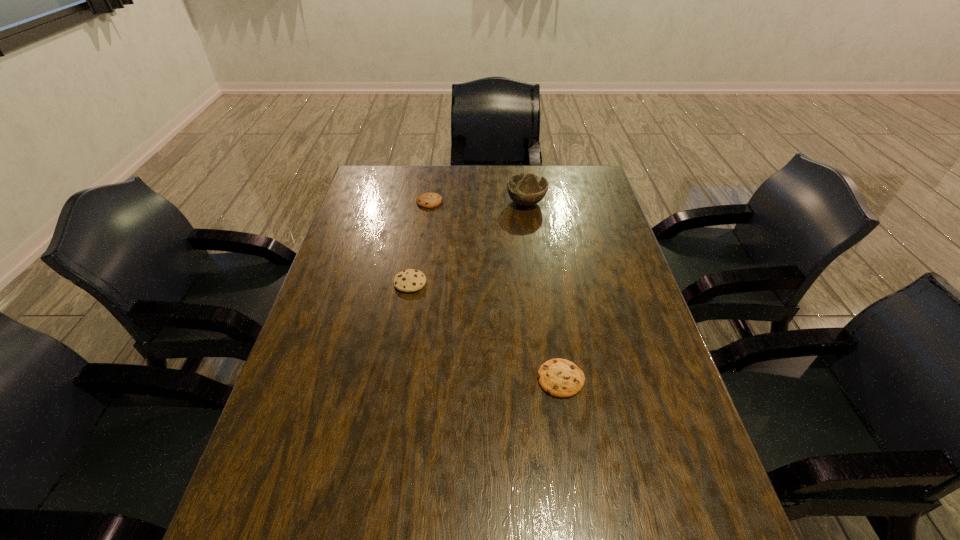
At what (x,y) coordinates should I click in order to perform the action: click on bowl. Please return your answer as a coordinate pair (x, y). Looking at the image, I should click on (526, 189).

Find the location of a particular element. The height and width of the screenshot is (540, 960). the tallest cookie is located at coordinates (410, 280).

This screenshot has height=540, width=960. What are the coordinates of `the second tallest object` in the screenshot? It's located at (410, 280).

In order to click on the third tallest object in this screenshot , I will do `click(426, 200)`.

Identify the location of the farthest cookie. [x=426, y=200].

Locate an element on the screen. The width and height of the screenshot is (960, 540). the shortest object is located at coordinates (560, 378).

You are a GUI agent. You are given a task and a screenshot of the screen. Output one action in this format:
    pyautogui.click(x=<x>, y=<y>)
    Task: Click on the shortest cookie
    The width and height of the screenshot is (960, 540).
    Given the screenshot: What is the action you would take?
    pyautogui.click(x=560, y=378)

Identify the location of free point located 0.190m on the back of the bowl. (521, 166).

Where is `vacant space located on the right of the third shortest object`? The width and height of the screenshot is (960, 540). vacant space located on the right of the third shortest object is located at coordinates (446, 283).

Where is `vacant space located 0.150m on the back of the third tallest object`? This screenshot has height=540, width=960. vacant space located 0.150m on the back of the third tallest object is located at coordinates (434, 174).